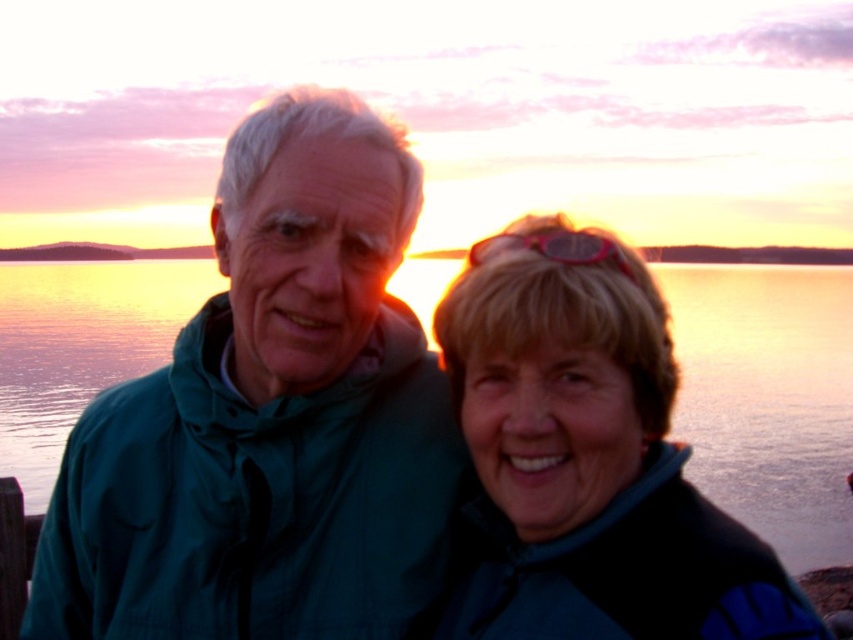
Question: Can you confirm if glossy water at center is positioned to the left of pink translucent goggles at upper center?

Choices:
 (A) no
 (B) yes

Answer: (B)

Question: Which of these objects is positioned farthest from the glossy water at center?

Choices:
 (A) pink translucent goggles at upper center
 (B) green fabric jacket at left
 (C) blue fleece jacket at center

Answer: (A)

Question: Which point is farther to the camera?

Choices:
 (A) green fabric jacket at left
 (B) pink translucent goggles at upper center
 (C) glossy water at center
 (D) blue fleece jacket at center

Answer: (C)

Question: In this image, where is blue fleece jacket at center located relative to glossy water at center?

Choices:
 (A) left
 (B) right

Answer: (B)

Question: Which of these objects is positioned farthest from the glossy water at center?

Choices:
 (A) blue fleece jacket at center
 (B) green fabric jacket at left
 (C) pink translucent goggles at upper center

Answer: (C)

Question: Does green fabric jacket at left appear on the right side of blue fleece jacket at center?

Choices:
 (A) no
 (B) yes

Answer: (A)